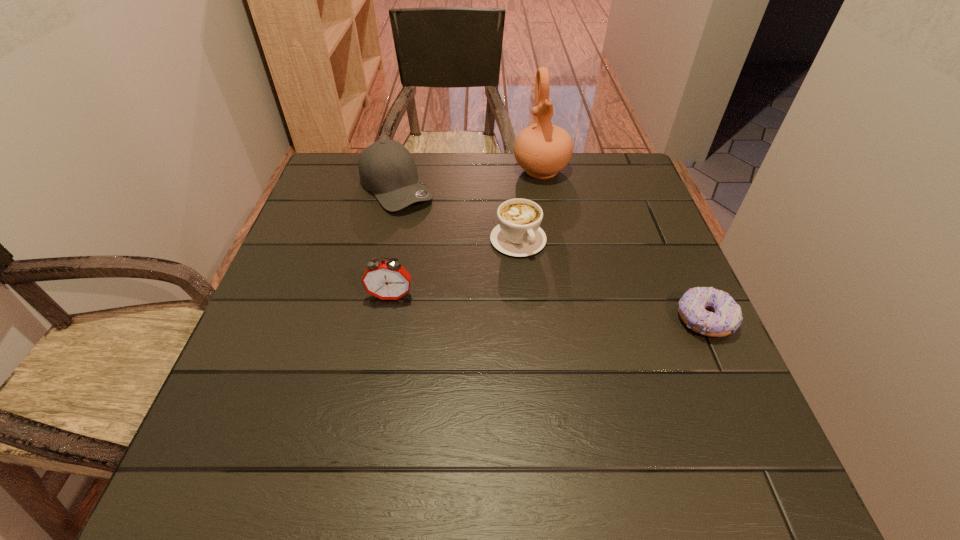
Where is `vacant spot on the desktop that is between the alarm clock and the doughnut and is positioned to the right of the cappuccino's handle`? The width and height of the screenshot is (960, 540). vacant spot on the desktop that is between the alarm clock and the doughnut and is positioned to the right of the cappuccino's handle is located at coordinates (573, 309).

The image size is (960, 540). What are the coordinates of `free space on the desktop that is between the alarm clock and the doughnut and is positioned on the spout of the tallest object` in the screenshot? It's located at (584, 310).

Find the location of a particular element. free spot on the desktop that is between the alarm clock and the shortest object and is positioned on the front brim of the baseball cap is located at coordinates (506, 305).